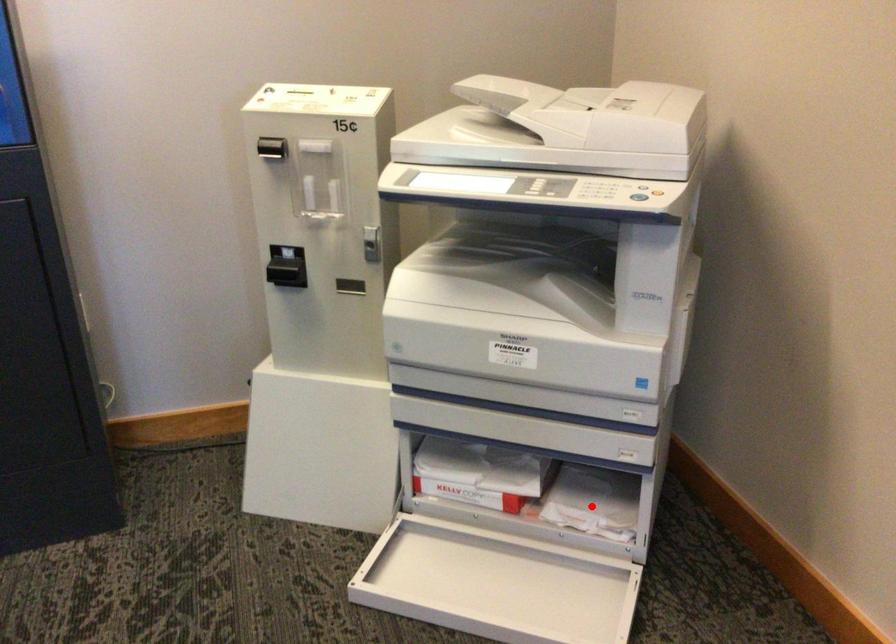
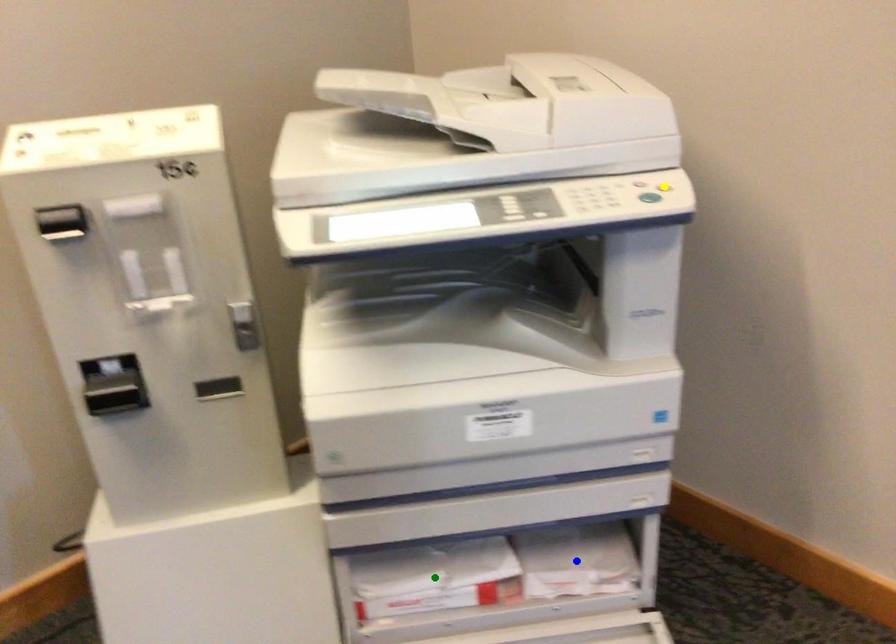
Question: I am providing you with two images of the same scene from different viewpoints. A red point is marked on the first image. You are given multiple points on the second image. In image 2, which mark is for the same physical point as the one in image 1?

Choices:
 (A) green point
 (B) blue point
 (C) yellow point

Answer: (B)